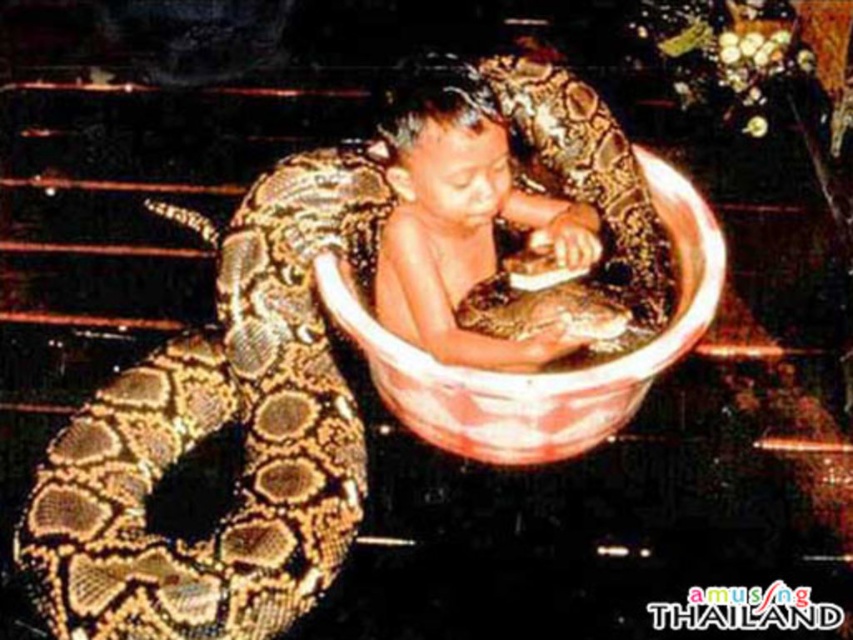
Question: Which object appears closest to the camera in this image?

Choices:
 (A) matte ceramic bowl at center
 (B) smooth skin child at center
 (C) brown scaly snake at center

Answer: (C)

Question: Does brown scaly snake at center have a greater width compared to smooth skin child at center?

Choices:
 (A) no
 (B) yes

Answer: (B)

Question: Considering the real-world distances, which object is closest to the matte ceramic bowl at center?

Choices:
 (A) brown scaly snake at center
 (B) smooth skin child at center

Answer: (B)

Question: Does brown scaly snake at center have a greater width compared to matte ceramic bowl at center?

Choices:
 (A) no
 (B) yes

Answer: (A)

Question: Does brown scaly snake at center have a lesser width compared to matte ceramic bowl at center?

Choices:
 (A) yes
 (B) no

Answer: (A)

Question: Estimate the real-world distances between objects in this image. Which object is closer to the brown scaly snake at center?

Choices:
 (A) matte ceramic bowl at center
 (B) smooth skin child at center

Answer: (B)